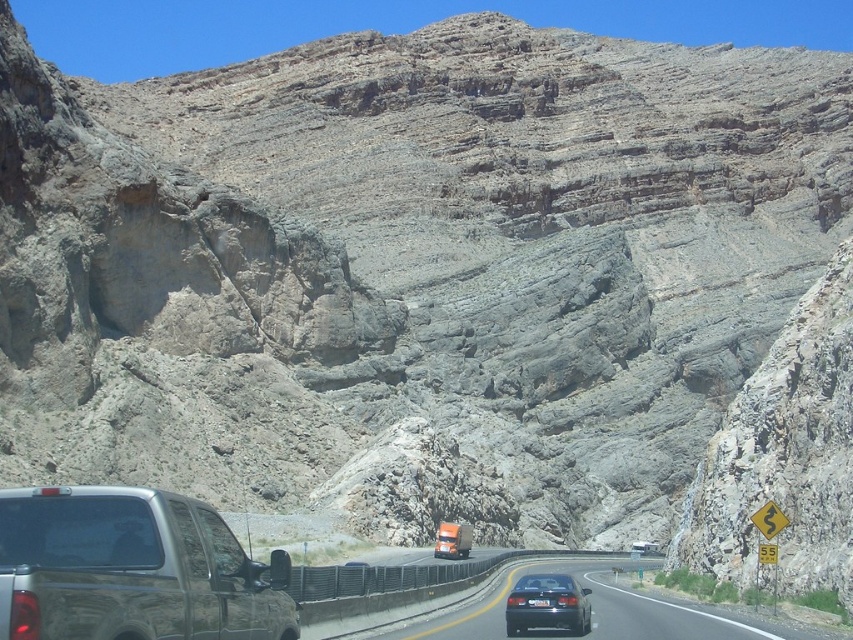
You are driving a car and see the black asphalt road at center and the black plastic license plate at center in your view. Which object is closer to you?

The black asphalt road at center is closer to you because it is in front of the black plastic license plate at center.

You are driving a car and want to pass the metallic gray truck at left on this narrow desert highway. The black plastic license plate at center is on the sedan ahead. Can you safely pass the truck without crossing the yellow dividing line if your car is 2 meters wide?

The metallic gray truck at left might be wider than black plastic license plate at center, but since the question mentions the truck is at the left and the license plate is on the sedan ahead at center, the width comparison isn

You are navigating a desert highway and see a metallic gray truck at left. Based on its position, can you determine if it is closer to the camera or farther away compared to the other vehicles?

The metallic gray truck at left is located at point [132,570], which places it closer to the camera compared to other vehicles on the road.